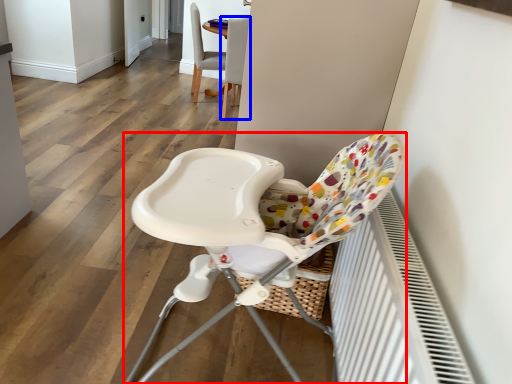
Question: Which point is closer to the camera, chair (highlighted by a red box) or chair (highlighted by a blue box)?

Choices:
 (A) chair
 (B) chair

Answer: (A)